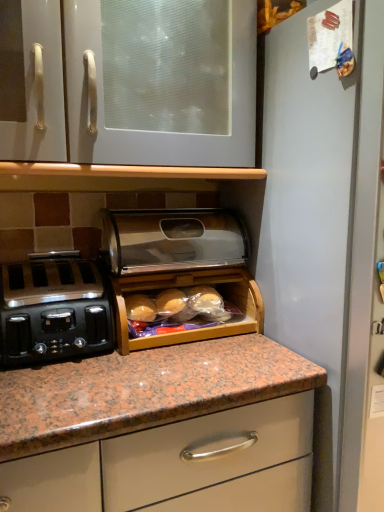
Question: Does wooden bread box at center, which is the first appliance from bottom to top, have a lesser width compared to polished stainless steel bread box at center, the 2th appliance ordered from the bottom?

Choices:
 (A) no
 (B) yes

Answer: (B)

Question: Is wooden bread box at center, the second appliance from the top, further to the viewer compared to polished stainless steel bread box at center, which appears as the 1th appliance when viewed from the top?

Choices:
 (A) yes
 (B) no

Answer: (B)

Question: Is the depth of wooden bread box at center, the second appliance from the top, less than that of polished stainless steel bread box at center, the 2th appliance ordered from the bottom?

Choices:
 (A) no
 (B) yes

Answer: (B)

Question: Considering the relative positions of wooden bread box at center, the second appliance from the top, and polished stainless steel bread box at center, which appears as the 1th appliance when viewed from the top, in the image provided, is wooden bread box at center, the second appliance from the top, to the left of polished stainless steel bread box at center, which appears as the 1th appliance when viewed from the top, from the viewer's perspective?

Choices:
 (A) no
 (B) yes

Answer: (A)

Question: Is wooden bread box at center, the second appliance from the top, aimed at polished stainless steel bread box at center, which appears as the 1th appliance when viewed from the top?

Choices:
 (A) yes
 (B) no

Answer: (B)

Question: In the image, is wooden bread box at center, which is the first appliance from bottom to top, on the left side or the right side of polished stainless steel bread box at center, which appears as the 1th appliance when viewed from the top?

Choices:
 (A) left
 (B) right

Answer: (B)

Question: Is wooden bread box at center, the second appliance from the top, wider or thinner than polished stainless steel bread box at center, the 2th appliance ordered from the bottom?

Choices:
 (A) thin
 (B) wide

Answer: (A)

Question: In terms of height, does wooden bread box at center, the second appliance from the top, look taller or shorter compared to polished stainless steel bread box at center, the 2th appliance ordered from the bottom?

Choices:
 (A) short
 (B) tall

Answer: (B)

Question: Considering the positions of point (249, 327) and point (175, 263), is point (249, 327) closer or farther from the camera than point (175, 263)?

Choices:
 (A) closer
 (B) farther

Answer: (B)

Question: Is polished stainless steel bread box at center, which appears as the 1th appliance when viewed from the top, taller or shorter than white glossy cabinet at upper center?

Choices:
 (A) tall
 (B) short

Answer: (B)

Question: From the image's perspective, relative to white glossy cabinet at upper center, is polished stainless steel bread box at center, the 2th appliance ordered from the bottom, above or below?

Choices:
 (A) below
 (B) above

Answer: (A)

Question: From a real-world perspective, is polished stainless steel bread box at center, the 2th appliance ordered from the bottom, positioned above or below white glossy cabinet at upper center?

Choices:
 (A) above
 (B) below

Answer: (B)

Question: Is polished stainless steel bread box at center, the 2th appliance ordered from the bottom, to the left or to the right of white glossy cabinet at upper center in the image?

Choices:
 (A) right
 (B) left

Answer: (A)

Question: Considering their positions, is wooden bread box at center, which is the first appliance from bottom to top, located in front of or behind white glossy cabinet at upper center?

Choices:
 (A) front
 (B) behind

Answer: (B)

Question: From a real-world perspective, is wooden bread box at center, the second appliance from the top, above or below white glossy cabinet at upper center?

Choices:
 (A) below
 (B) above

Answer: (A)